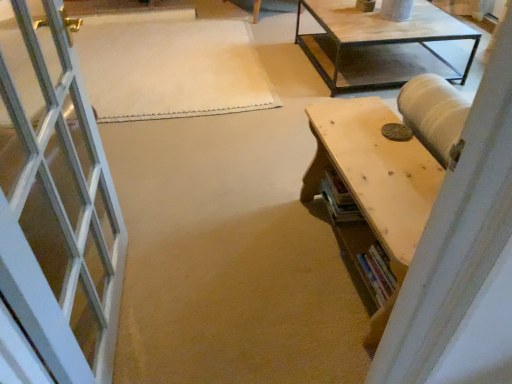
Where is `vacant space situated on the left part of wooden table at right`? The height and width of the screenshot is (384, 512). vacant space situated on the left part of wooden table at right is located at coordinates (233, 255).